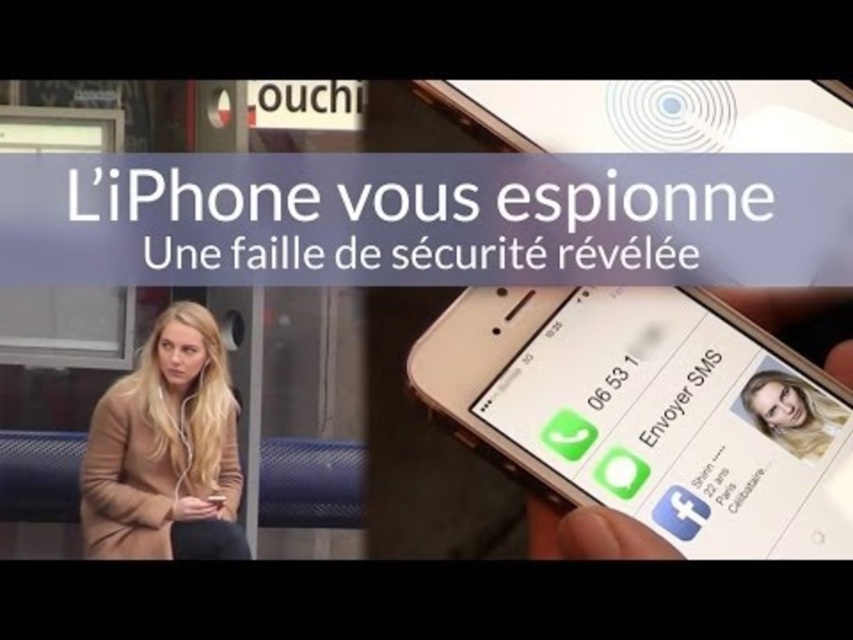
Which is more to the right, camel wool coat at left or white glossy text message at center?

white glossy text message at center

Can you confirm if camel wool coat at left is bigger than white glossy text message at center?

Yes, camel wool coat at left is bigger than white glossy text message at center.

Measure the distance between camel wool coat at left and camera.

camel wool coat at left is 1.15 meters from camera.

At what (x,y) coordinates should I click in order to perform the action: click on camel wool coat at left. Please return your answer as a coordinate pair (x, y). Looking at the image, I should click on (166, 451).

Looking at this image, does white paper text at upper center have a larger size compared to camel wool coat at left?

Indeed, white paper text at upper center has a larger size compared to camel wool coat at left.

Measure the distance between white paper text at upper center and camel wool coat at left.

They are 12.27 inches apart.

I want to click on white paper text at upper center, so click(410, 214).

Does white paper text at upper center have a lesser height compared to white glossy text message at center?

No, white paper text at upper center is not shorter than white glossy text message at center.

Who is more distant from viewer, (660, 182) or (669, 422)?

The point (660, 182) is behind.

What are the coordinates of `white paper text at upper center` in the screenshot? It's located at (x=410, y=214).

Locate an element on the screen. white paper text at upper center is located at coordinates (410, 214).